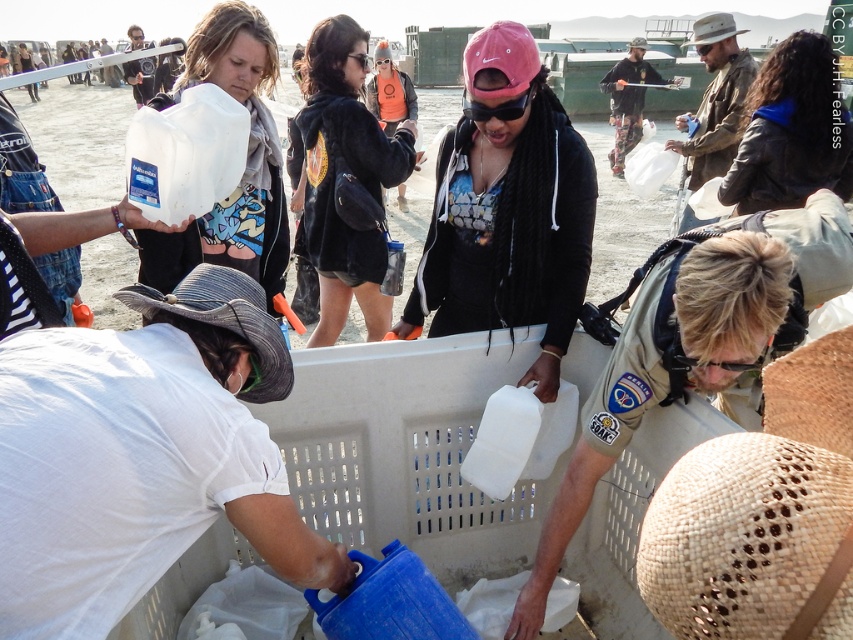
Question: Does matte white jug at center lie in front of black fuzzy jacket at center?

Choices:
 (A) no
 (B) yes

Answer: (B)

Question: Which point appears farthest from the camera in this image?

Choices:
 (A) (788, 150)
 (B) (339, 148)
 (C) (541, 340)

Answer: (A)

Question: Which point is farther to the camera?

Choices:
 (A) blue leather jacket at upper right
 (B) matte white jug at upper left
 (C) black fuzzy jacket at center
 (D) matte white jug at center

Answer: (A)

Question: Is matte white jug at center to the right of black fuzzy jacket at center from the viewer's perspective?

Choices:
 (A) yes
 (B) no

Answer: (A)

Question: Is black fuzzy jacket at center positioned behind blue leather jacket at upper right?

Choices:
 (A) yes
 (B) no

Answer: (B)

Question: Which is nearer to the matte white jug at upper left?

Choices:
 (A) matte white jug at center
 (B) blue leather jacket at upper right

Answer: (A)